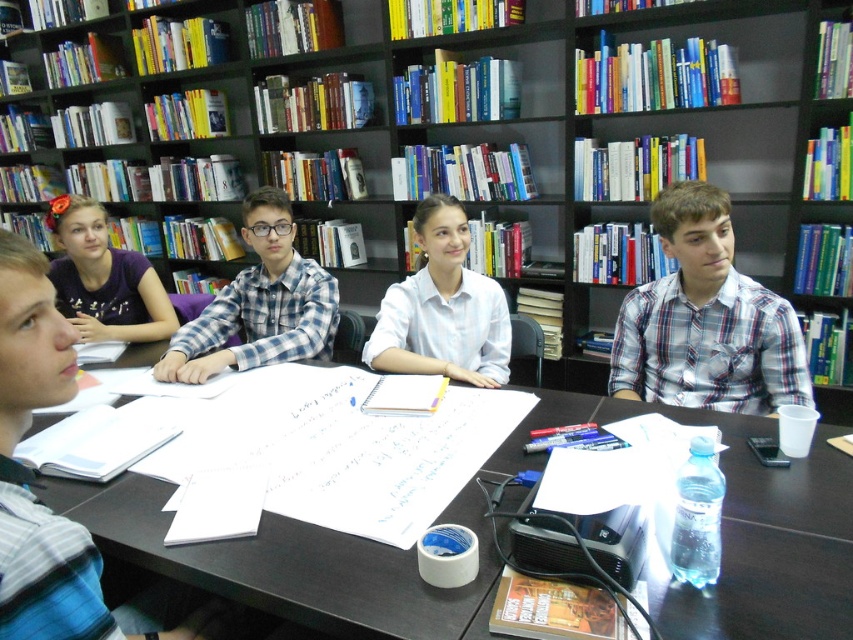
Question: Does wooden bookshelf at upper center appear over purple fabric shirt at upper left?

Choices:
 (A) yes
 (B) no

Answer: (A)

Question: Which point is closer to the camera taking this photo?

Choices:
 (A) (223, 333)
 (B) (360, 138)

Answer: (A)

Question: Which of these objects is positioned closest to the wooden bookshelf at upper center?

Choices:
 (A) black wood table at center
 (B) white shirt at center
 (C) blue plaid shirt at center
 (D) purple fabric shirt at upper left

Answer: (B)

Question: Which of the following is the closest to the observer?

Choices:
 (A) purple fabric shirt at upper left
 (B) black wood table at center
 (C) white shirt at center

Answer: (B)

Question: Does wooden bookshelf at upper center have a greater width compared to blue plaid shirt at center?

Choices:
 (A) yes
 (B) no

Answer: (A)

Question: Does white shirt at center have a larger size compared to purple fabric shirt at upper left?

Choices:
 (A) yes
 (B) no

Answer: (B)